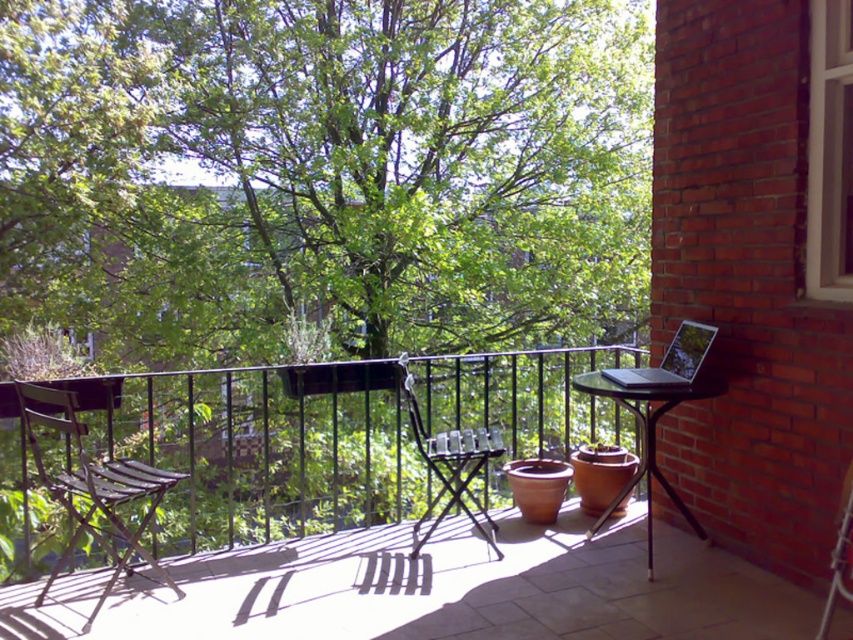
Which is more to the right, wooden slatted chair at left or black metal chair at center?

From the viewer's perspective, black metal chair at center appears more on the right side.

Who is positioned more to the left, wooden slatted chair at left or black metal chair at center?

Positioned to the left is wooden slatted chair at left.

The height and width of the screenshot is (640, 853). Identify the location of wooden slatted chair at left. (91, 484).

Image resolution: width=853 pixels, height=640 pixels. In order to click on wooden slatted chair at left in this screenshot , I will do `click(91, 484)`.

Is black metal chair at center shorter than silver metallic laptop at right?

No.

Where is `black metal chair at center`? The width and height of the screenshot is (853, 640). black metal chair at center is located at coordinates (450, 464).

Is black metal table at right taller than metallic silver chair at lower right?

Correct, black metal table at right is much taller as metallic silver chair at lower right.

Between point (668, 400) and point (849, 481), which one is positioned behind?

The point (668, 400) is behind.

Which is in front, point (642, 436) or point (849, 520)?

Point (849, 520) is in front.

Locate an element on the screen. The height and width of the screenshot is (640, 853). black metal table at right is located at coordinates (648, 440).